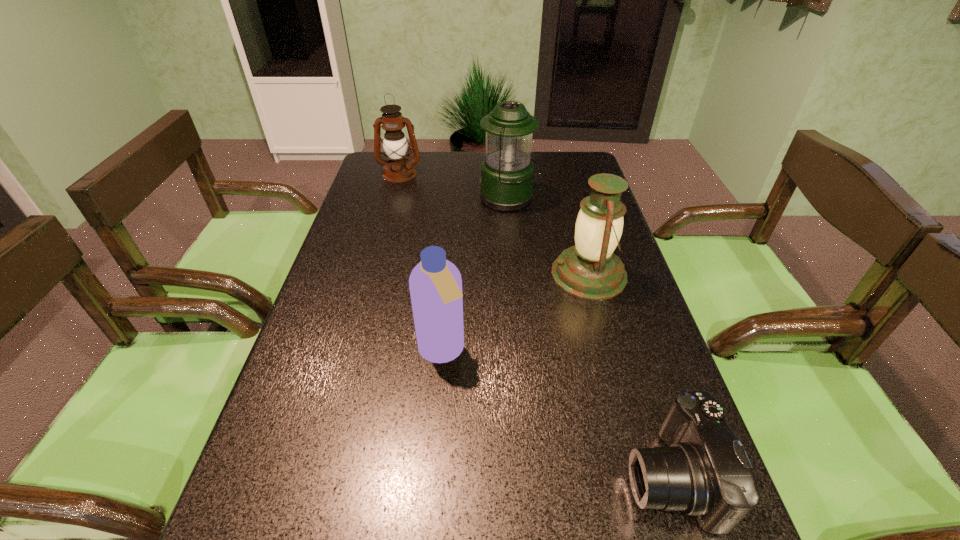
The height and width of the screenshot is (540, 960). In order to click on vacant area situated with the light compartment facing forward on the third farthest object in this screenshot , I will do `click(426, 274)`.

The height and width of the screenshot is (540, 960). Find the location of `vacant space located 0.380m with the light compartment facing forward on the third farthest object`. vacant space located 0.380m with the light compartment facing forward on the third farthest object is located at coordinates (402, 274).

Identify the location of free location located with the light compartment facing forward on the third farthest object. This screenshot has height=540, width=960. (512, 274).

This screenshot has height=540, width=960. Identify the location of vacant space situated on the back of the shampoo. (449, 256).

I want to click on free space located 0.360m on the lens of the camera, so click(x=414, y=475).

Where is `free space located on the lens of the camera`? free space located on the lens of the camera is located at coordinates [491, 475].

The height and width of the screenshot is (540, 960). Identify the location of free space located 0.350m on the lens of the camera. (420, 475).

I want to click on object at the left edge, so (x=398, y=169).

At what (x,y) coordinates should I click in order to perform the action: click on lantern present at the right edge. Please return your answer as a coordinate pair (x, y). Looking at the image, I should click on (590, 270).

Identify the location of camera at the right edge. (705, 472).